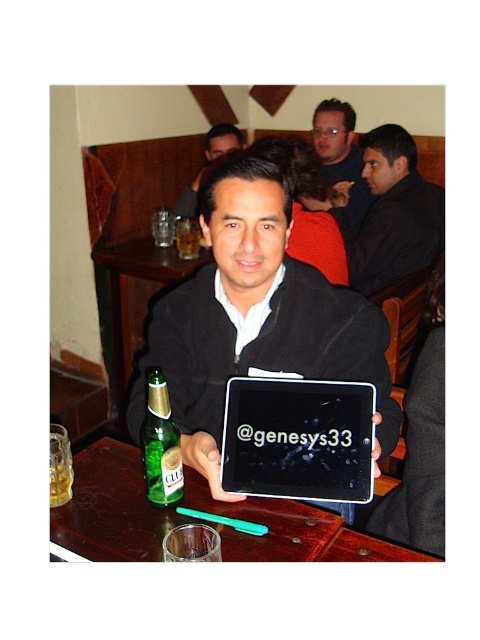
You are a waiter in a restaurant. You need to deliver a drink to the customer who is looking at the matte black tablet at center. The customer is wearing the matte black shirt at upper center. Which direction should you approach from to place the drink near the tablet?

The matte black tablet at center is to the left of the matte black shirt at upper center, so you should approach from the right side of the customer to place the drink near the tablet.

You are a photographer trying to capture the matte black tablet at center and the matte black jacket at center in a single shot. Based on their positions, which object would appear closer to the camera in the photo?

The matte black tablet at center is below the matte black jacket at center, so in the photo, the matte black jacket at center would appear closer to the camera since it is positioned higher in the frame.

You are a photographer taking a picture of the scene. Which object, the matte black tablet at center or the matte black jacket at center, will appear larger in the photo?

The matte black tablet at center will appear larger in the photo because it is closer to the viewer than the matte black jacket at center.